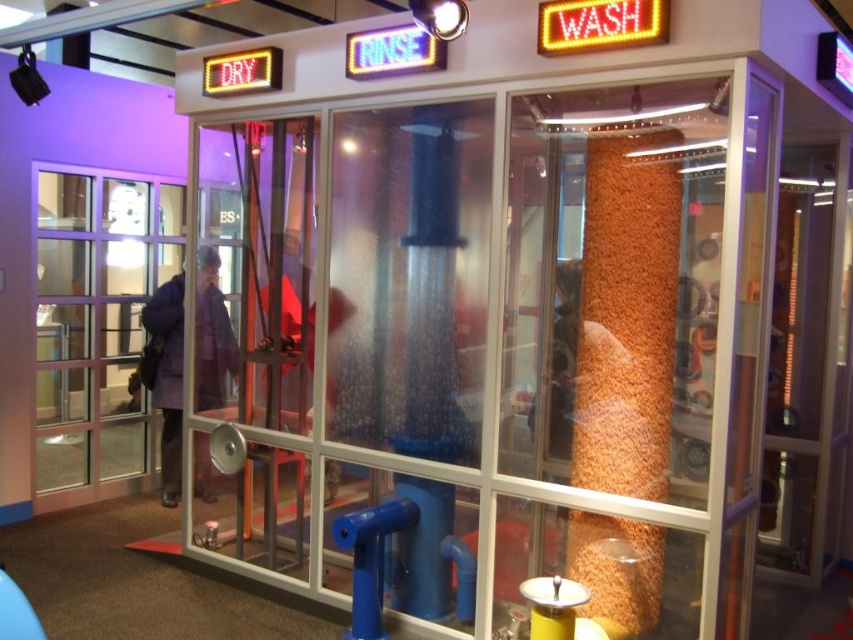
Does clear glass door at left appear on the right side of matte red shirt at center?

Incorrect, clear glass door at left is not on the right side of matte red shirt at center.

Is clear glass door at left smaller than matte red shirt at center?

Actually, clear glass door at left might be larger than matte red shirt at center.

Is point (108, 451) behind point (309, 401)?

Yes, point (108, 451) is farther from viewer.

Where is `clear glass door at left`? clear glass door at left is located at coordinates (97, 326).

Which is below, clear glass door at left or purple fabric coat at center?

Positioned lower is purple fabric coat at center.

Locate an element on the screen. clear glass door at left is located at coordinates (97, 326).

Image resolution: width=853 pixels, height=640 pixels. I want to click on clear glass door at left, so click(x=97, y=326).

Does purple fabric coat at center have a greater width compared to matte red shirt at center?

Incorrect, purple fabric coat at center's width does not surpass matte red shirt at center's.

Identify the location of purple fabric coat at center. (167, 378).